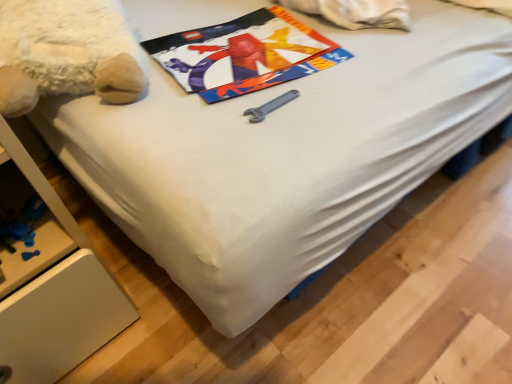
Question: From the image's perspective, is metallic poster at center below fluffy white teddy bear at upper left?

Choices:
 (A) no
 (B) yes

Answer: (B)

Question: Is metallic poster at center wider than fluffy white teddy bear at upper left?

Choices:
 (A) no
 (B) yes

Answer: (A)

Question: From a real-world perspective, is metallic poster at center beneath fluffy white teddy bear at upper left?

Choices:
 (A) no
 (B) yes

Answer: (B)

Question: Is metallic poster at center thinner than fluffy white teddy bear at upper left?

Choices:
 (A) no
 (B) yes

Answer: (B)

Question: Considering the relative sizes of metallic poster at center and fluffy white teddy bear at upper left in the image provided, is metallic poster at center smaller than fluffy white teddy bear at upper left?

Choices:
 (A) no
 (B) yes

Answer: (B)

Question: Is metallic poster at center to the right of fluffy white teddy bear at upper left from the viewer's perspective?

Choices:
 (A) yes
 (B) no

Answer: (A)

Question: Considering the relative sizes of fluffy white teddy bear at upper left and metallic poster at center in the image provided, is fluffy white teddy bear at upper left shorter than metallic poster at center?

Choices:
 (A) no
 (B) yes

Answer: (A)

Question: From a real-world perspective, is fluffy white teddy bear at upper left on metallic poster at center?

Choices:
 (A) no
 (B) yes

Answer: (B)

Question: Does fluffy white teddy bear at upper left have a greater width compared to metallic poster at center?

Choices:
 (A) no
 (B) yes

Answer: (B)

Question: Is fluffy white teddy bear at upper left facing away from metallic poster at center?

Choices:
 (A) no
 (B) yes

Answer: (A)

Question: Is fluffy white teddy bear at upper left bigger than metallic poster at center?

Choices:
 (A) yes
 (B) no

Answer: (A)

Question: Is fluffy white teddy bear at upper left positioned beyond the bounds of metallic poster at center?

Choices:
 (A) no
 (B) yes

Answer: (B)

Question: Is fluffy white teddy bear at upper left taller or shorter than metallic poster at center?

Choices:
 (A) tall
 (B) short

Answer: (A)